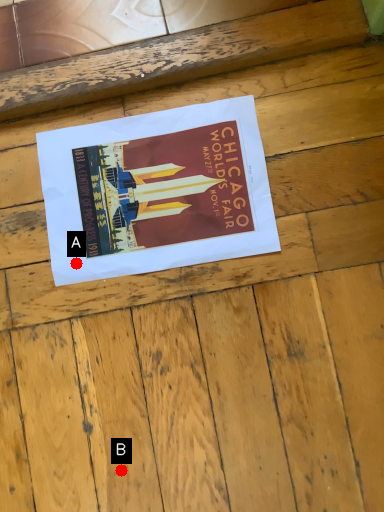
Question: Two points are circled on the image, labeled by A and B beside each circle. Which point is closer to the camera?

Choices:
 (A) A is closer
 (B) B is closer

Answer: (B)